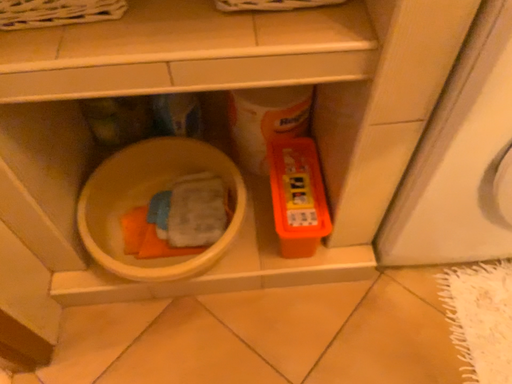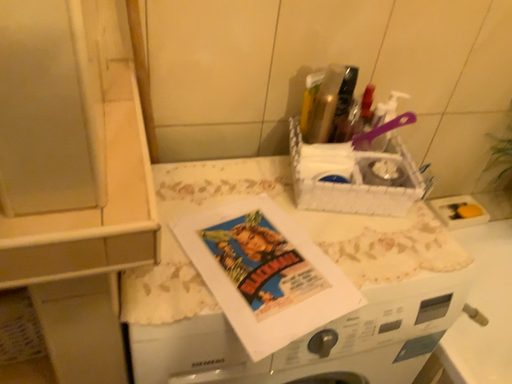
Question: Which way did the camera rotate in the video?

Choices:
 (A) rotated upward
 (B) rotated downward

Answer: (A)